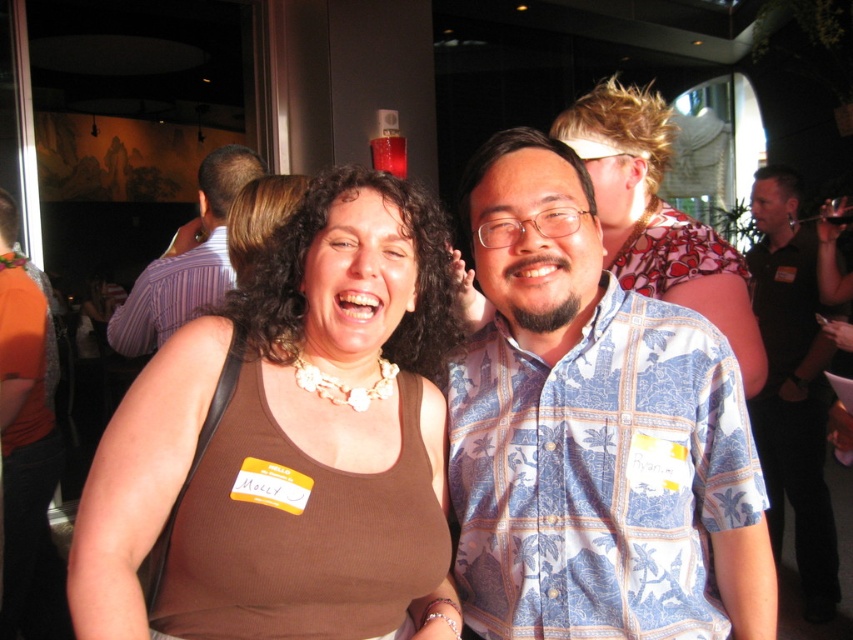
Who is taller, brown ribbed tank top at center or blue patterned shirt at center?

blue patterned shirt at center is taller.

Locate an element on the screen. The width and height of the screenshot is (853, 640). brown ribbed tank top at center is located at coordinates (292, 397).

Where is `brown ribbed tank top at center`? This screenshot has width=853, height=640. brown ribbed tank top at center is located at coordinates (292, 397).

Can you confirm if blue printed shirt at center is positioned to the right of brown ribbed tank top at center?

Yes, blue printed shirt at center is to the right of brown ribbed tank top at center.

Does blue printed shirt at center have a lesser width compared to brown ribbed tank top at center?

Yes.

Which is behind, point (628, 548) or point (370, 260)?

Point (370, 260)

Locate an element on the screen. blue printed shirt at center is located at coordinates (593, 433).

Is blue printed shirt at center shorter than purple striped shirt at center?

Yes.

Is blue printed shirt at center above purple striped shirt at center?

Incorrect, blue printed shirt at center is not positioned above purple striped shirt at center.

Is point (505, 477) farther from viewer compared to point (202, 308)?

No, it is in front of (202, 308).

Image resolution: width=853 pixels, height=640 pixels. Identify the location of blue printed shirt at center. (593, 433).